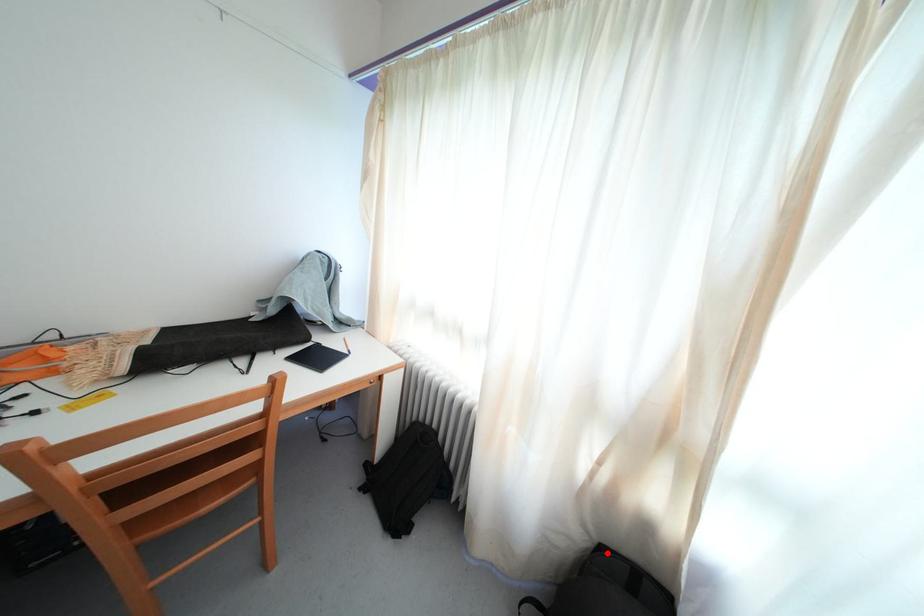
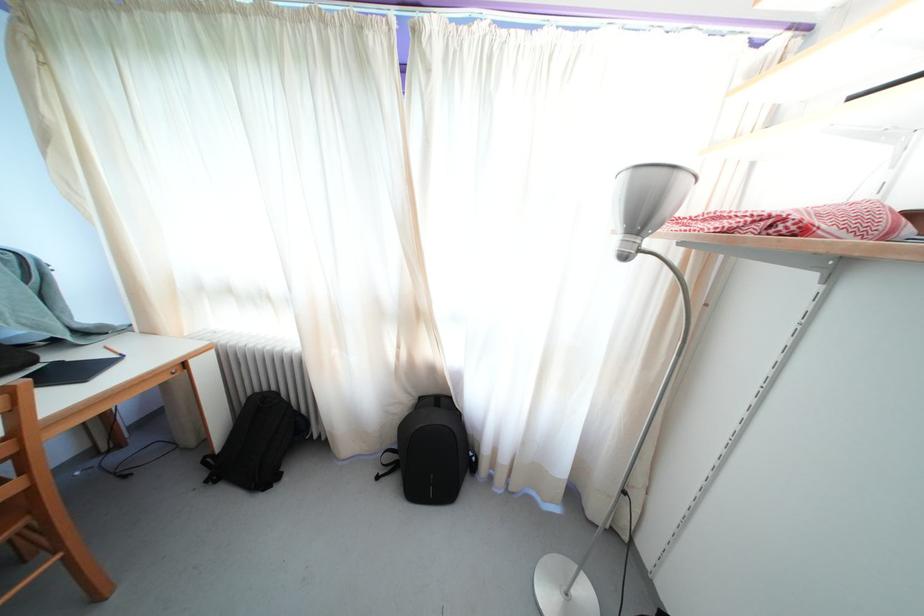
Question: I am providing you with two images of the same scene from different viewpoints. In image1, a red point is highlighted. Considering the same 3D point in image2, which of the following is correct?

Choices:
 (A) It is closer
 (B) It is farther

Answer: (B)